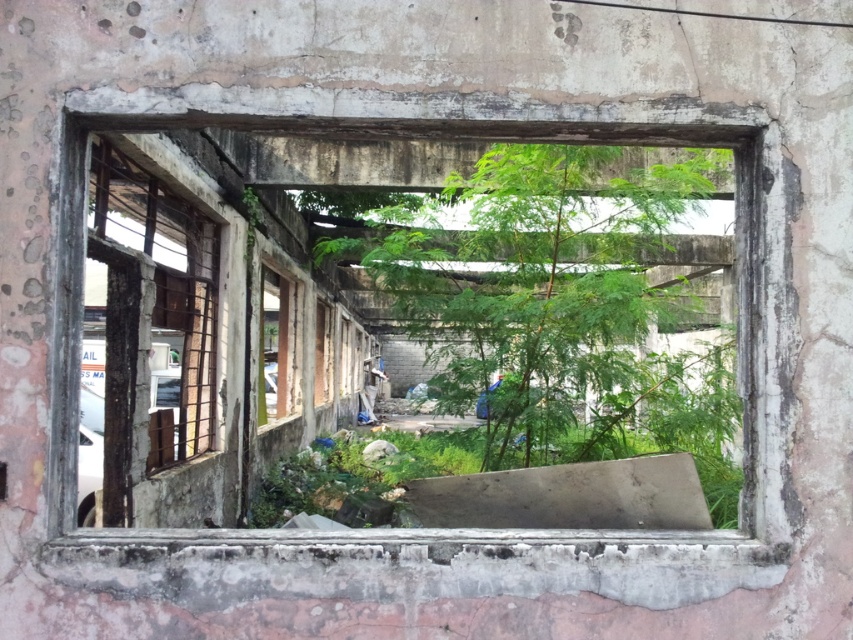
Is rusty concrete window frame at center further to the viewer compared to green leafy tree at center?

No, it is in front of green leafy tree at center.

Who is positioned more to the right, rusty concrete window frame at center or green leafy tree at center?

green leafy tree at center is more to the right.

Locate an element on the screen. rusty concrete window frame at center is located at coordinates (354, 330).

Which is above, rusty concrete window frame at center or rusty metal window at left?

Positioned higher is rusty concrete window frame at center.

Who is more forward, (114, 368) or (119, 224)?

Point (114, 368) is more forward.

Is point (219, 275) farther from camera compared to point (204, 282)?

That is True.

This screenshot has height=640, width=853. I want to click on rusty concrete window frame at center, so click(354, 330).

Can you confirm if green leafy tree at center is wider than rusty metal window at left?

Correct, the width of green leafy tree at center exceeds that of rusty metal window at left.

Does point (578, 276) lie in front of point (114, 212)?

No, (578, 276) is behind (114, 212).

The width and height of the screenshot is (853, 640). Describe the element at coordinates (554, 296) in the screenshot. I see `green leafy tree at center` at that location.

Identify the location of green leafy tree at center. This screenshot has height=640, width=853. (554, 296).